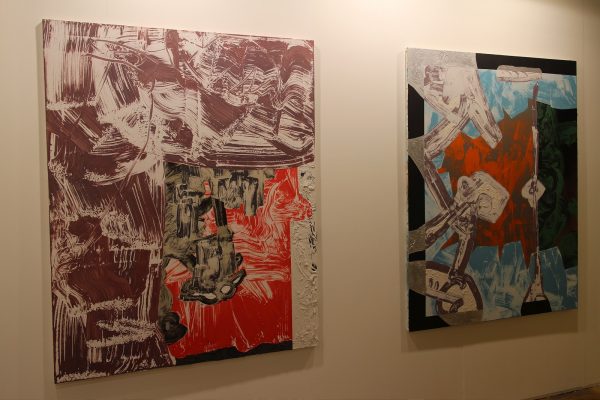
The image size is (600, 400). I want to click on floor, so click(578, 393).